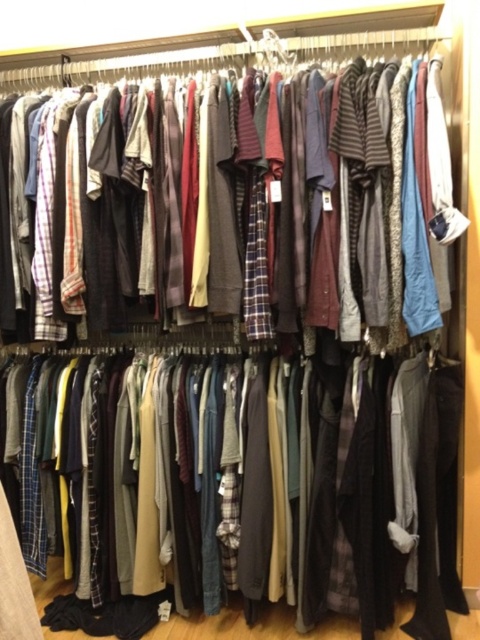
Measure the distance between dark gray sweater at center and plaid fabric shirts at center.

The distance of dark gray sweater at center from plaid fabric shirts at center is 20.07 inches.

Is dark gray sweater at center positioned at the back of plaid fabric shirts at center?

Yes, it is.

Between point (431, 573) and point (295, 122), which one is positioned behind?

The point (431, 573) is behind.

Locate an element on the screen. dark gray sweater at center is located at coordinates (241, 477).